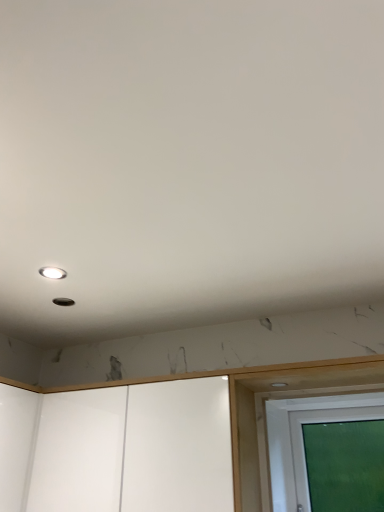
Question: Is white glossy cabinet at lower center, acting as the 2th screen door starting from the right, wider than transparent glass screen door at lower right, the 2th screen door in the left-to-right sequence?

Choices:
 (A) yes
 (B) no

Answer: (A)

Question: Is white glossy cabinet at lower center, acting as the 2th screen door starting from the right, located outside transparent glass screen door at lower right, which is the 1th screen door in right-to-left order?

Choices:
 (A) no
 (B) yes

Answer: (B)

Question: Could transparent glass screen door at lower right, the 2th screen door in the left-to-right sequence, be considered to be inside white glossy cabinet at lower center, acting as the 2th screen door starting from the right?

Choices:
 (A) no
 (B) yes

Answer: (A)

Question: From the image's perspective, is white glossy cabinet at lower center, which is counted as the first screen door, starting from the left, located above transparent glass screen door at lower right, the 2th screen door in the left-to-right sequence?

Choices:
 (A) yes
 (B) no

Answer: (A)

Question: Is transparent glass screen door at lower right, the 2th screen door in the left-to-right sequence, at the back of white glossy cabinet at lower center, acting as the 2th screen door starting from the right?

Choices:
 (A) yes
 (B) no

Answer: (B)

Question: From the image's perspective, is white glossy cabinet at lower center, acting as the 2th screen door starting from the right, located above or below transparent glass screen door at lower right, which is the 1th screen door in right-to-left order?

Choices:
 (A) above
 (B) below

Answer: (A)

Question: From a real-world perspective, is white glossy cabinet at lower center, which is counted as the first screen door, starting from the left, physically located above or below transparent glass screen door at lower right, the 2th screen door in the left-to-right sequence?

Choices:
 (A) below
 (B) above

Answer: (B)

Question: In terms of height, does white glossy cabinet at lower center, which is counted as the first screen door, starting from the left, look taller or shorter compared to transparent glass screen door at lower right, the 2th screen door in the left-to-right sequence?

Choices:
 (A) short
 (B) tall

Answer: (B)

Question: Is point (137, 400) closer or farther from the camera than point (291, 478)?

Choices:
 (A) farther
 (B) closer

Answer: (B)

Question: Based on their sizes in the image, would you say white glossy cabinet at lower center, acting as the 2th screen door starting from the right, is bigger or smaller than matte white droplight at upper left?

Choices:
 (A) small
 (B) big

Answer: (B)

Question: Looking at their shapes, would you say white glossy cabinet at lower center, acting as the 2th screen door starting from the right, is wider or thinner than matte white droplight at upper left?

Choices:
 (A) wide
 (B) thin

Answer: (A)

Question: From the image's perspective, is white glossy cabinet at lower center, which is counted as the first screen door, starting from the left, positioned above or below matte white droplight at upper left?

Choices:
 (A) above
 (B) below

Answer: (B)

Question: Is white glossy cabinet at lower center, acting as the 2th screen door starting from the right, spatially inside matte white droplight at upper left, or outside of it?

Choices:
 (A) outside
 (B) inside

Answer: (A)

Question: Considering the positions of transparent glass screen door at lower right, which is the 1th screen door in right-to-left order, and matte white droplight at upper left in the image, is transparent glass screen door at lower right, which is the 1th screen door in right-to-left order, bigger or smaller than matte white droplight at upper left?

Choices:
 (A) small
 (B) big

Answer: (B)

Question: In the image, is transparent glass screen door at lower right, the 2th screen door in the left-to-right sequence, positioned in front of or behind matte white droplight at upper left?

Choices:
 (A) behind
 (B) front

Answer: (A)